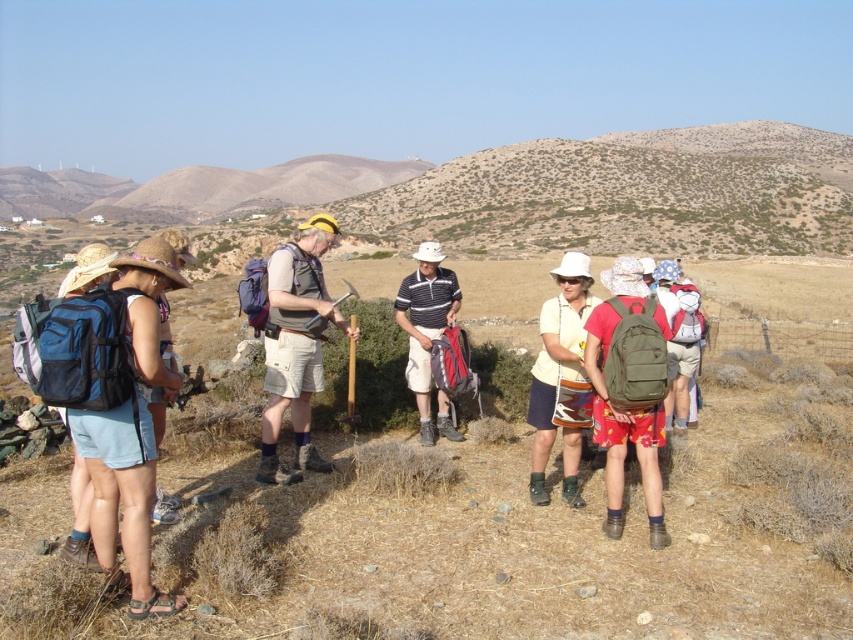
Question: Which object is the farthest from the matte gray vest at center?

Choices:
 (A) blue fabric backpack at left
 (B) olive green fabric backpack at center-right
 (C) striped polo shirt at center

Answer: (B)

Question: Is blue fabric backpack at left to the right of striped polo shirt at center from the viewer's perspective?

Choices:
 (A) yes
 (B) no

Answer: (B)

Question: Can you confirm if matte gray vest at center is positioned to the left of matte yellow shirt at center?

Choices:
 (A) yes
 (B) no

Answer: (A)

Question: Which of the following is the closest to the observer?

Choices:
 (A) (548, 308)
 (B) (633, 312)

Answer: (B)

Question: In this image, where is matte gray vest at center located relative to matte yellow shirt at center?

Choices:
 (A) right
 (B) left

Answer: (B)

Question: Which point is farther from the camera taking this photo?

Choices:
 (A) (276, 305)
 (B) (625, 410)
 (C) (426, 358)

Answer: (C)